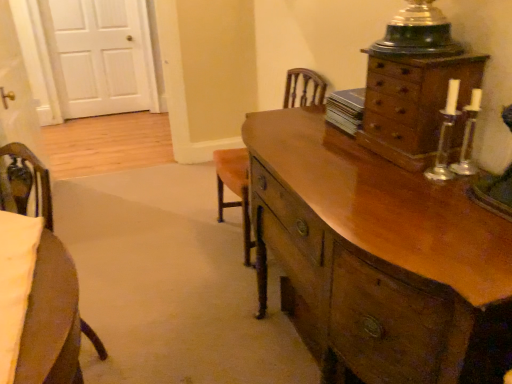
The image size is (512, 384). What do you see at coordinates (234, 189) in the screenshot? I see `wooden armchair at center` at bounding box center [234, 189].

Describe the element at coordinates (100, 56) in the screenshot. I see `white wood door at upper left` at that location.

How much space does shiny brown wooden chest of drawers at right, placed as the 2th chest of drawers when sorted from top to bottom, occupy horizontally?

It is 22.91 inches.

Where is `wooden armchair at center`? wooden armchair at center is located at coordinates (234, 189).

Does point (404, 225) come in front of point (91, 108)?

Yes, it is.

In terms of height, does shiny brown wooden chest of drawers at right, placed as the 2th chest of drawers when sorted from top to bottom, look taller or shorter compared to white wood door at upper left?

shiny brown wooden chest of drawers at right, placed as the 2th chest of drawers when sorted from top to bottom, is shorter than white wood door at upper left.

Is white wood door at upper left surrounded by shiny brown wooden chest of drawers at right, placed as the 2th chest of drawers when sorted from top to bottom?

No, white wood door at upper left is not a part of shiny brown wooden chest of drawers at right, placed as the 2th chest of drawers when sorted from top to bottom.

Where is `the chest of drawers that is the 2nd one when counting forward from the white wood door at upper left`? the chest of drawers that is the 2nd one when counting forward from the white wood door at upper left is located at coordinates (377, 258).

Locate an element on the screen. The height and width of the screenshot is (384, 512). door lying behind the wooden chest of drawers at upper right, which is the 1th chest of drawers from top to bottom is located at coordinates (100, 56).

Is wooden chest of drawers at upper right, the 2th chest of drawers positioned from the bottom, not near white wood door at upper left?

Absolutely, wooden chest of drawers at upper right, the 2th chest of drawers positioned from the bottom, is distant from white wood door at upper left.

In the image, is wooden chest of drawers at upper right, the 2th chest of drawers positioned from the bottom, positioned in front of or behind white wood door at upper left?

wooden chest of drawers at upper right, the 2th chest of drawers positioned from the bottom, is positioned closer to the viewer than white wood door at upper left.

Is white wood door at upper left turned away from shiny brown wooden chest of drawers at right, acting as the first chest of drawers starting from the bottom?

No, white wood door at upper left is not facing away from shiny brown wooden chest of drawers at right, acting as the first chest of drawers starting from the bottom.

Image resolution: width=512 pixels, height=384 pixels. What are the coordinates of `the 1st chest of drawers to the right of the white wood door at upper left, starting your count from the anchor` in the screenshot? It's located at (377, 258).

Which is behind, point (70, 99) or point (319, 312)?

Positioned behind is point (70, 99).

Considering the sizes of objects white wood door at upper left and shiny brown wooden chest of drawers at right, acting as the first chest of drawers starting from the bottom, in the image provided, who is smaller, white wood door at upper left or shiny brown wooden chest of drawers at right, acting as the first chest of drawers starting from the bottom,?

white wood door at upper left is smaller.

Consider the image. Is shiny brown wooden chest of drawers at right, placed as the 2th chest of drawers when sorted from top to bottom, far from wooden chest of drawers at upper right, the 2th chest of drawers positioned from the bottom?

No, shiny brown wooden chest of drawers at right, placed as the 2th chest of drawers when sorted from top to bottom, is not far away from wooden chest of drawers at upper right, the 2th chest of drawers positioned from the bottom.

Is wooden chest of drawers at upper right, the 2th chest of drawers positioned from the bottom, surrounded by shiny brown wooden chest of drawers at right, acting as the first chest of drawers starting from the bottom?

No, wooden chest of drawers at upper right, the 2th chest of drawers positioned from the bottom, is located outside of shiny brown wooden chest of drawers at right, acting as the first chest of drawers starting from the bottom.

In terms of width, does shiny brown wooden chest of drawers at right, placed as the 2th chest of drawers when sorted from top to bottom, look wider or thinner when compared to wooden chest of drawers at upper right, which is the 1th chest of drawers from top to bottom?

shiny brown wooden chest of drawers at right, placed as the 2th chest of drawers when sorted from top to bottom, is wider than wooden chest of drawers at upper right, which is the 1th chest of drawers from top to bottom.

Are shiny brown wooden chest of drawers at right, acting as the first chest of drawers starting from the bottom, and wooden armchair at center far apart?

Actually, shiny brown wooden chest of drawers at right, acting as the first chest of drawers starting from the bottom, and wooden armchair at center are a little close together.

From a real-world perspective, between shiny brown wooden chest of drawers at right, acting as the first chest of drawers starting from the bottom, and wooden armchair at center, who is vertically higher?

From a 3D spatial view, wooden armchair at center is above.

Is shiny brown wooden chest of drawers at right, placed as the 2th chest of drawers when sorted from top to bottom, facing towards wooden armchair at center?

No, shiny brown wooden chest of drawers at right, placed as the 2th chest of drawers when sorted from top to bottom, is not turned towards wooden armchair at center.

Which is less distant, (461, 88) or (303, 74)?

The point (461, 88) is more forward.

Can you confirm if wooden chest of drawers at upper right, the 2th chest of drawers positioned from the bottom, is smaller than wooden armchair at center?

Yes, wooden chest of drawers at upper right, the 2th chest of drawers positioned from the bottom, is smaller than wooden armchair at center.

Between wooden chest of drawers at upper right, the 2th chest of drawers positioned from the bottom, and wooden armchair at center, which one has more height?

With more height is wooden armchair at center.

Considering the relative sizes of wooden chest of drawers at upper right, the 2th chest of drawers positioned from the bottom, and wooden armchair at center in the image provided, is wooden chest of drawers at upper right, the 2th chest of drawers positioned from the bottom, wider than wooden armchair at center?

No, wooden chest of drawers at upper right, the 2th chest of drawers positioned from the bottom, is not wider than wooden armchair at center.

Is white wood door at upper left spatially inside wooden chest of drawers at upper right, the 2th chest of drawers positioned from the bottom, or outside of it?

white wood door at upper left is spatially situated outside wooden chest of drawers at upper right, the 2th chest of drawers positioned from the bottom.

From the image's perspective, which is below, white wood door at upper left or wooden chest of drawers at upper right, which is the 1th chest of drawers from top to bottom?

From the image's view, wooden chest of drawers at upper right, which is the 1th chest of drawers from top to bottom, is below.

In the scene shown: Does white wood door at upper left appear on the left side of wooden chest of drawers at upper right, the 2th chest of drawers positioned from the bottom?

Yes, white wood door at upper left is to the left of wooden chest of drawers at upper right, the 2th chest of drawers positioned from the bottom.

Is white wood door at upper left thinner than wooden chest of drawers at upper right, the 2th chest of drawers positioned from the bottom?

Indeed, white wood door at upper left has a lesser width compared to wooden chest of drawers at upper right, the 2th chest of drawers positioned from the bottom.

Identify the location of door located behind the shiny brown wooden chest of drawers at right, placed as the 2th chest of drawers when sorted from top to bottom. 100,56.

Find the location of a particular element. door lying on the left of wooden chest of drawers at upper right, which is the 1th chest of drawers from top to bottom is located at coordinates (100, 56).

Based on their spatial positions, is wooden armchair at center or shiny brown wooden chest of drawers at right, placed as the 2th chest of drawers when sorted from top to bottom, further from white wood door at upper left?

The object further to white wood door at upper left is shiny brown wooden chest of drawers at right, placed as the 2th chest of drawers when sorted from top to bottom.

In the scene shown: Looking at the image, which one is located further to wooden chest of drawers at upper right, which is the 1th chest of drawers from top to bottom, shiny brown wooden chest of drawers at right, acting as the first chest of drawers starting from the bottom, or white wood door at upper left?

The object further to wooden chest of drawers at upper right, which is the 1th chest of drawers from top to bottom, is white wood door at upper left.

Based on their spatial positions, is shiny brown wooden chest of drawers at right, acting as the first chest of drawers starting from the bottom, or wooden armchair at center further from white wood door at upper left?

shiny brown wooden chest of drawers at right, acting as the first chest of drawers starting from the bottom, is positioned further to the anchor white wood door at upper left.

From the image, which object appears to be farther from wooden armchair at center, white wood door at upper left or shiny brown wooden chest of drawers at right, acting as the first chest of drawers starting from the bottom?

white wood door at upper left lies further to wooden armchair at center than the other object.

Based on their spatial positions, is shiny brown wooden chest of drawers at right, acting as the first chest of drawers starting from the bottom, or wooden chest of drawers at upper right, which is the 1th chest of drawers from top to bottom, closer to white wood door at upper left?

Among the two, shiny brown wooden chest of drawers at right, acting as the first chest of drawers starting from the bottom, is located nearer to white wood door at upper left.

Which object lies nearer to the anchor point wooden chest of drawers at upper right, which is the 1th chest of drawers from top to bottom, wooden armchair at center or white wood door at upper left?

wooden armchair at center is positioned closer to the anchor wooden chest of drawers at upper right, which is the 1th chest of drawers from top to bottom.

Looking at the image, which one is located further to white wood door at upper left, wooden armchair at center or wooden chest of drawers at upper right, the 2th chest of drawers positioned from the bottom?

wooden chest of drawers at upper right, the 2th chest of drawers positioned from the bottom, lies further to white wood door at upper left than the other object.

When comparing their distances from shiny brown wooden chest of drawers at right, placed as the 2th chest of drawers when sorted from top to bottom, does wooden chest of drawers at upper right, which is the 1th chest of drawers from top to bottom, or white wood door at upper left seem closer?

The object closer to shiny brown wooden chest of drawers at right, placed as the 2th chest of drawers when sorted from top to bottom, is wooden chest of drawers at upper right, which is the 1th chest of drawers from top to bottom.

The image size is (512, 384). What are the coordinates of `armchair between shiny brown wooden chest of drawers at right, acting as the first chest of drawers starting from the bottom, and white wood door at upper left in the front-back direction` in the screenshot? It's located at (234, 189).

The width and height of the screenshot is (512, 384). Identify the location of chest of drawers between shiny brown wooden chest of drawers at right, placed as the 2th chest of drawers when sorted from top to bottom, and wooden armchair at center in the front-back direction. (412, 103).

Where is `chest of drawers between shiny brown wooden chest of drawers at right, placed as the 2th chest of drawers when sorted from top to bottom, and white wood door at upper left in the front-back direction`? The width and height of the screenshot is (512, 384). chest of drawers between shiny brown wooden chest of drawers at right, placed as the 2th chest of drawers when sorted from top to bottom, and white wood door at upper left in the front-back direction is located at coordinates (412, 103).

In order to click on armchair located between wooden chest of drawers at upper right, the 2th chest of drawers positioned from the bottom, and white wood door at upper left in the depth direction in this screenshot , I will do `click(234, 189)`.